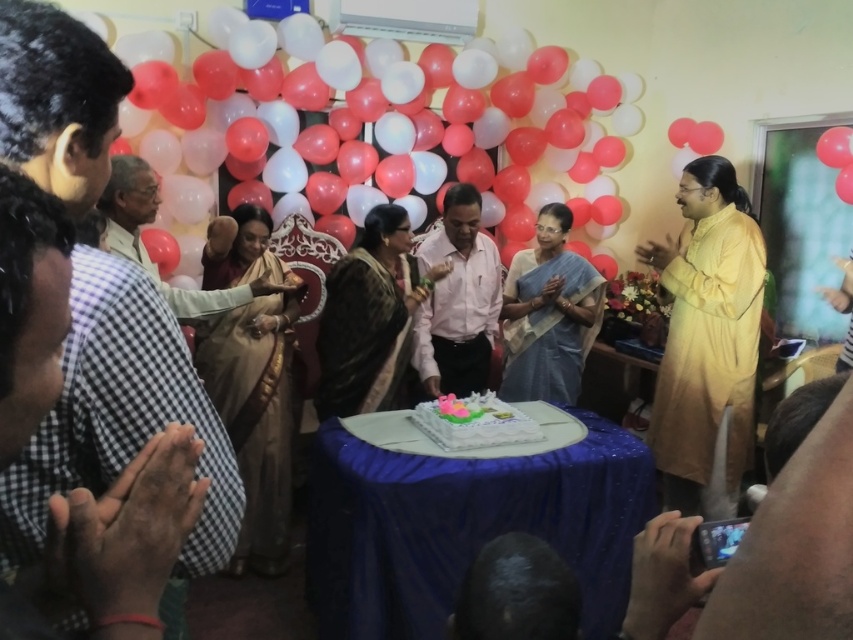
Which of these two, white matte balloons at upper center or blue silk saree at center, stands taller?

With more height is white matte balloons at upper center.

Does white matte balloons at upper center appear under blue silk saree at center?

Actually, white matte balloons at upper center is above blue silk saree at center.

Is point (403, 90) more distant than point (570, 262)?

That is True.

Identify the location of white matte balloons at upper center. [x=395, y=124].

Looking at this image, which is above, white matte balloons at upper center or pink shirt at center?

white matte balloons at upper center is higher up.

Who is shorter, white matte balloons at upper center or pink shirt at center?

Standing shorter between the two is pink shirt at center.

Where is `white matte balloons at upper center`? white matte balloons at upper center is located at coordinates 395,124.

The height and width of the screenshot is (640, 853). What are the coordinates of `white matte balloons at upper center` in the screenshot? It's located at (395, 124).

Which is more to the right, white matte balloons at upper center or light brown fabric saree at center?

white matte balloons at upper center

Can you confirm if white matte balloons at upper center is positioned above light brown fabric saree at center?

Yes.

Which is in front, point (322, 164) or point (238, 301)?

Point (238, 301)

The height and width of the screenshot is (640, 853). Find the location of `white matte balloons at upper center`. white matte balloons at upper center is located at coordinates (395, 124).